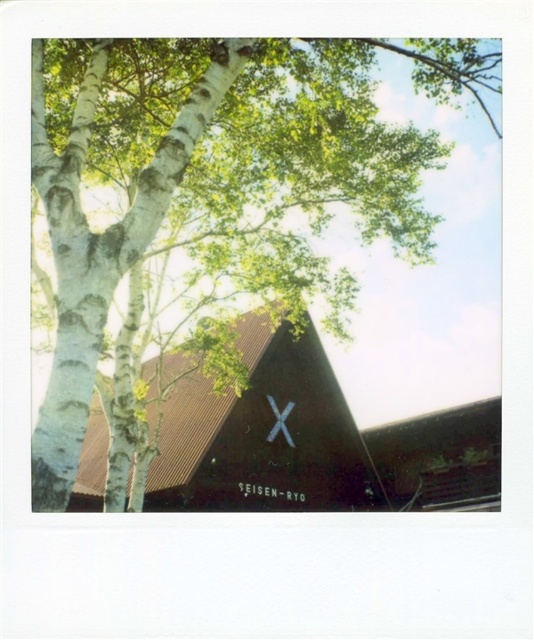
Question: Which point appears farthest from the camera in this image?

Choices:
 (A) (192, 458)
 (B) (287, 416)

Answer: (B)

Question: Considering the real-world distances, which object is farthest from the brown corrugated metal chapel at center?

Choices:
 (A) white matte cross at center
 (B) white bark tree at upper left

Answer: (B)

Question: Which object is positioned farthest from the white matte cross at center?

Choices:
 (A) brown corrugated metal chapel at center
 (B) white bark tree at upper left

Answer: (B)

Question: Considering the relative positions of white bark tree at upper left and brown corrugated metal chapel at center in the image provided, where is white bark tree at upper left located with respect to brown corrugated metal chapel at center?

Choices:
 (A) right
 (B) left

Answer: (A)

Question: Can you confirm if white bark tree at upper left is positioned to the right of brown corrugated metal chapel at center?

Choices:
 (A) yes
 (B) no

Answer: (A)

Question: Does white bark tree at upper left have a larger size compared to white matte cross at center?

Choices:
 (A) no
 (B) yes

Answer: (B)